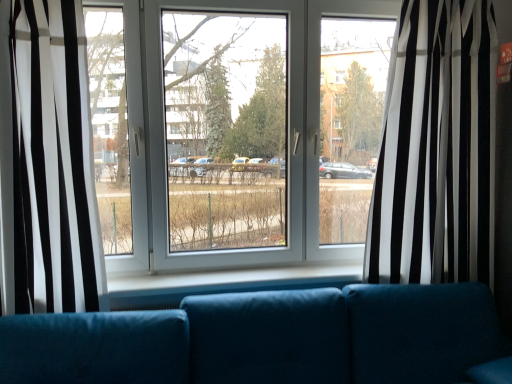
Question: Is white sheer curtain at left, which is the 2th curtain from right to left, shorter than black/white striped curtain at center, which is the 2th curtain from left to right?

Choices:
 (A) yes
 (B) no

Answer: (A)

Question: From a real-world perspective, is white sheer curtain at left, which is counted as the first curtain, starting from the left, physically below black/white striped curtain at center, the 1th curtain in the right-to-left sequence?

Choices:
 (A) yes
 (B) no

Answer: (A)

Question: Is white sheer curtain at left, which is counted as the first curtain, starting from the left, positioned before black/white striped curtain at center, the 1th curtain in the right-to-left sequence?

Choices:
 (A) yes
 (B) no

Answer: (A)

Question: Is white sheer curtain at left, which is counted as the first curtain, starting from the left, taller than black/white striped curtain at center, the 1th curtain in the right-to-left sequence?

Choices:
 (A) yes
 (B) no

Answer: (B)

Question: Is white sheer curtain at left, which is the 2th curtain from right to left, to the right of black/white striped curtain at center, the 1th curtain in the right-to-left sequence, from the viewer's perspective?

Choices:
 (A) yes
 (B) no

Answer: (B)

Question: From the image's perspective, is teal fabric couch at center located above or below white sheer curtain at left, which is the 2th curtain from right to left?

Choices:
 (A) above
 (B) below

Answer: (B)

Question: Relative to white sheer curtain at left, which is counted as the first curtain, starting from the left, is teal fabric couch at center in front or behind?

Choices:
 (A) front
 (B) behind

Answer: (A)

Question: From their relative heights in the image, would you say teal fabric couch at center is taller or shorter than white sheer curtain at left, which is the 2th curtain from right to left?

Choices:
 (A) short
 (B) tall

Answer: (A)

Question: Considering the positions of teal fabric couch at center and white sheer curtain at left, which is the 2th curtain from right to left, in the image, is teal fabric couch at center bigger or smaller than white sheer curtain at left, which is the 2th curtain from right to left,?

Choices:
 (A) small
 (B) big

Answer: (B)

Question: Is point (412, 261) closer or farther from the camera than point (231, 306)?

Choices:
 (A) closer
 (B) farther

Answer: (B)

Question: Is black/white striped curtain at center, the 1th curtain in the right-to-left sequence, inside or outside of teal fabric couch at center?

Choices:
 (A) outside
 (B) inside

Answer: (A)

Question: Considering the positions of black/white striped curtain at center, the 1th curtain in the right-to-left sequence, and teal fabric couch at center in the image, is black/white striped curtain at center, the 1th curtain in the right-to-left sequence, wider or thinner than teal fabric couch at center?

Choices:
 (A) wide
 (B) thin

Answer: (B)

Question: From a real-world perspective, is black/white striped curtain at center, the 1th curtain in the right-to-left sequence, positioned above or below teal fabric couch at center?

Choices:
 (A) above
 (B) below

Answer: (A)

Question: Considering the positions of white sheer curtain at left, which is counted as the first curtain, starting from the left, and black/white striped curtain at center, which is the 2th curtain from left to right, in the image, is white sheer curtain at left, which is counted as the first curtain, starting from the left, bigger or smaller than black/white striped curtain at center, which is the 2th curtain from left to right,?

Choices:
 (A) small
 (B) big

Answer: (A)

Question: Considering the relative positions of white sheer curtain at left, which is counted as the first curtain, starting from the left, and black/white striped curtain at center, which is the 2th curtain from left to right, in the image provided, is white sheer curtain at left, which is counted as the first curtain, starting from the left, to the left or to the right of black/white striped curtain at center, which is the 2th curtain from left to right,?

Choices:
 (A) left
 (B) right

Answer: (A)